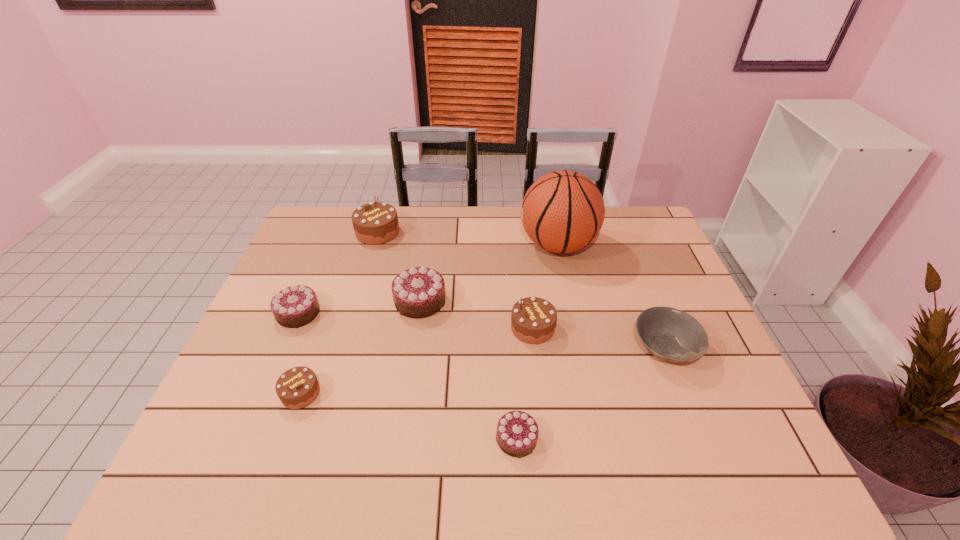
Locate an element on the screen. The width and height of the screenshot is (960, 540). free space that is in between the second nearest object and the second smallest chocolate chocolate cake is located at coordinates (300, 353).

Locate an element on the screen. This screenshot has width=960, height=540. vacant space in between the nearest brown chocolate cake and the second smallest chocolate chocolate cake is located at coordinates (300, 353).

I want to click on free space between the second farthest brown chocolate cake and the second smallest chocolate chocolate cake, so click(416, 320).

At what (x,y) coordinates should I click in order to perform the action: click on object that is the third closest to the second biggest chocolate chocolate cake. Please return your answer as a coordinate pair (x, y). Looking at the image, I should click on (374, 223).

Where is `object that ranks as the seventh closest to the second biggest chocolate chocolate cake`? The height and width of the screenshot is (540, 960). object that ranks as the seventh closest to the second biggest chocolate chocolate cake is located at coordinates (670, 334).

This screenshot has width=960, height=540. Identify the location of chocolate cake that is the third nearest to the nearest brown chocolate cake. (517, 432).

Image resolution: width=960 pixels, height=540 pixels. What are the coordinates of `chocolate cake that stands as the second closest to the second biggest chocolate chocolate cake` in the screenshot? It's located at (419, 292).

Find the location of a particular element. the third closest brown chocolate cake to the second smallest chocolate chocolate cake is located at coordinates (533, 319).

Select which brown chocolate cake appears as the second closest to the basketball. Please provide its 2D coordinates. Your answer should be formatted as a tuple, i.e. [(x, y)], where the tuple contains the x and y coordinates of a point satisfying the conditions above.

[(374, 223)]

Select which chocolate chocolate cake appears as the second closest to the seventh farthest object. Please provide its 2D coordinates. Your answer should be formatted as a tuple, i.e. [(x, y)], where the tuple contains the x and y coordinates of a point satisfying the conditions above.

[(419, 292)]